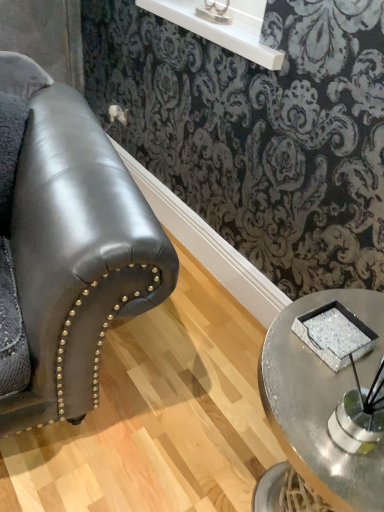
Question: Is sparkly silver tray at center positioned beyond the bounds of metallic silver tray at lower right?

Choices:
 (A) yes
 (B) no

Answer: (A)

Question: From a real-world perspective, is sparkly silver tray at center positioned over metallic silver tray at lower right based on gravity?

Choices:
 (A) yes
 (B) no

Answer: (B)

Question: Considering the relative sizes of sparkly silver tray at center and metallic silver tray at lower right in the image provided, is sparkly silver tray at center smaller than metallic silver tray at lower right?

Choices:
 (A) no
 (B) yes

Answer: (B)

Question: Can you confirm if sparkly silver tray at center is shorter than metallic silver tray at lower right?

Choices:
 (A) no
 (B) yes

Answer: (B)

Question: Can you confirm if sparkly silver tray at center is positioned to the left of metallic silver tray at lower right?

Choices:
 (A) no
 (B) yes

Answer: (A)

Question: Looking at their shapes, would you say sparkly silver tray at center is wider or thinner than white glossy shelf at upper center?

Choices:
 (A) wide
 (B) thin

Answer: (B)

Question: From the image's perspective, is sparkly silver tray at center located above or below white glossy shelf at upper center?

Choices:
 (A) above
 (B) below

Answer: (B)

Question: Is point (365, 335) closer or farther from the camera than point (269, 53)?

Choices:
 (A) farther
 (B) closer

Answer: (B)

Question: Looking at the image, does sparkly silver tray at center seem bigger or smaller compared to white glossy shelf at upper center?

Choices:
 (A) small
 (B) big

Answer: (A)

Question: From a real-world perspective, is metallic silver table lamp at upper center above or below metallic silver tray at lower right?

Choices:
 (A) below
 (B) above

Answer: (B)

Question: In terms of size, does metallic silver table lamp at upper center appear bigger or smaller than metallic silver tray at lower right?

Choices:
 (A) big
 (B) small

Answer: (A)

Question: Considering the positions of metallic silver table lamp at upper center and metallic silver tray at lower right in the image, is metallic silver table lamp at upper center wider or thinner than metallic silver tray at lower right?

Choices:
 (A) wide
 (B) thin

Answer: (B)

Question: Would you say metallic silver table lamp at upper center is to the left or to the right of metallic silver tray at lower right in the picture?

Choices:
 (A) right
 (B) left

Answer: (B)

Question: From a real-world perspective, is white glossy shelf at upper center above or below sparkly silver tray at center?

Choices:
 (A) below
 (B) above

Answer: (B)

Question: Is white glossy shelf at upper center wider or thinner than sparkly silver tray at center?

Choices:
 (A) thin
 (B) wide

Answer: (B)